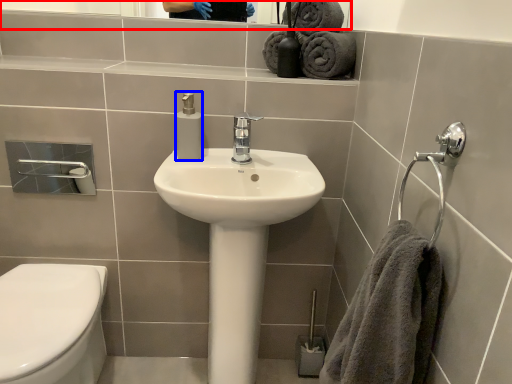
Question: Which object is closer to the camera taking this photo, mirror (highlighted by a red box) or soap dispenser (highlighted by a blue box)?

Choices:
 (A) mirror
 (B) soap dispenser

Answer: (B)